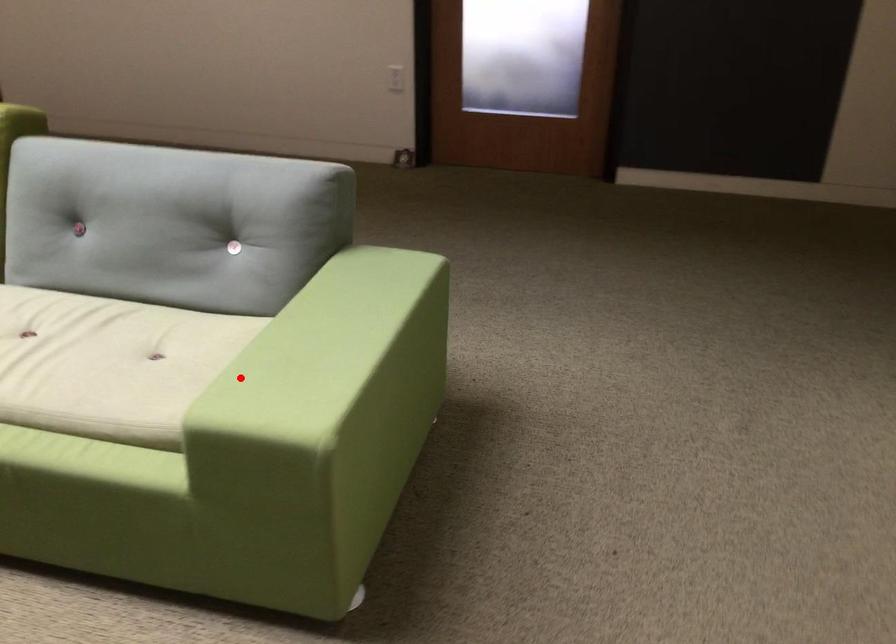
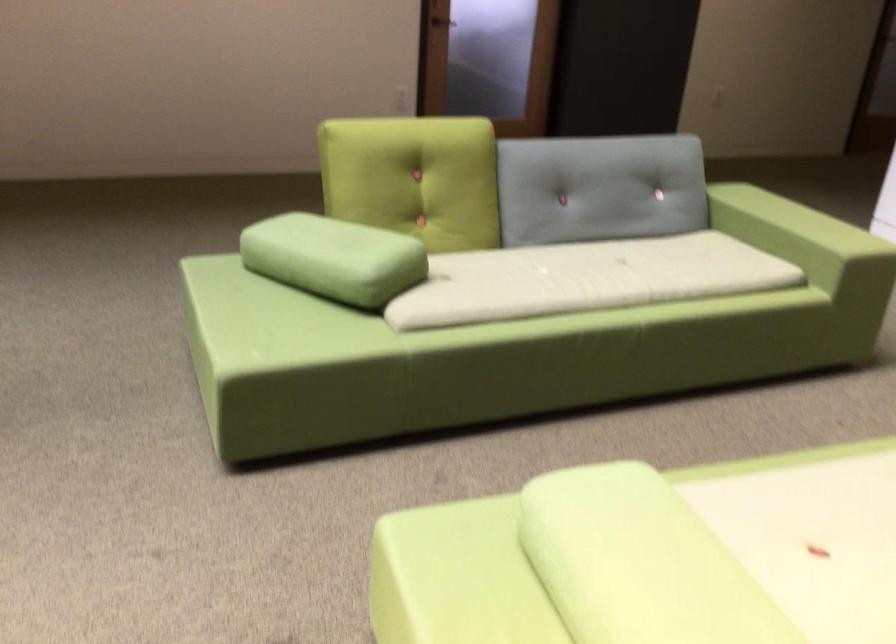
Where in the second image is the point corresponding to the highlighted location from the first image?

(794, 241)